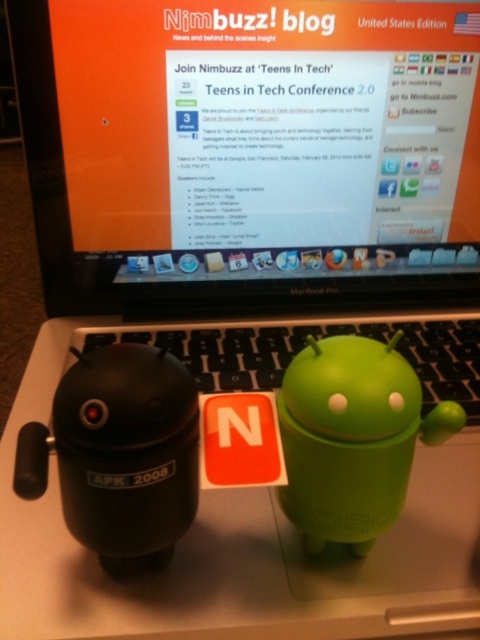
Question: Does matte black laptop at center appear over matte black figurine at lower left?

Choices:
 (A) no
 (B) yes

Answer: (B)

Question: In this image, where is matte plastic table at center located relative to green matte android at center?

Choices:
 (A) left
 (B) right

Answer: (A)

Question: Estimate the real-world distances between objects in this image. Which object is farther from the matte plastic table at center?

Choices:
 (A) matte black figurine at lower left
 (B) matte black laptop at center

Answer: (B)

Question: Which point is closer to the camera?

Choices:
 (A) matte black figurine at lower left
 (B) matte black laptop at center
 (C) green matte android at center
 (D) matte plastic table at center

Answer: (A)

Question: Is matte plastic table at center above matte black figurine at lower left?

Choices:
 (A) no
 (B) yes

Answer: (B)

Question: Among these points, which one is nearest to the camera?

Choices:
 (A) (348, 376)
 (B) (80, 64)
 (C) (233, 608)
 (D) (97, 470)

Answer: (D)